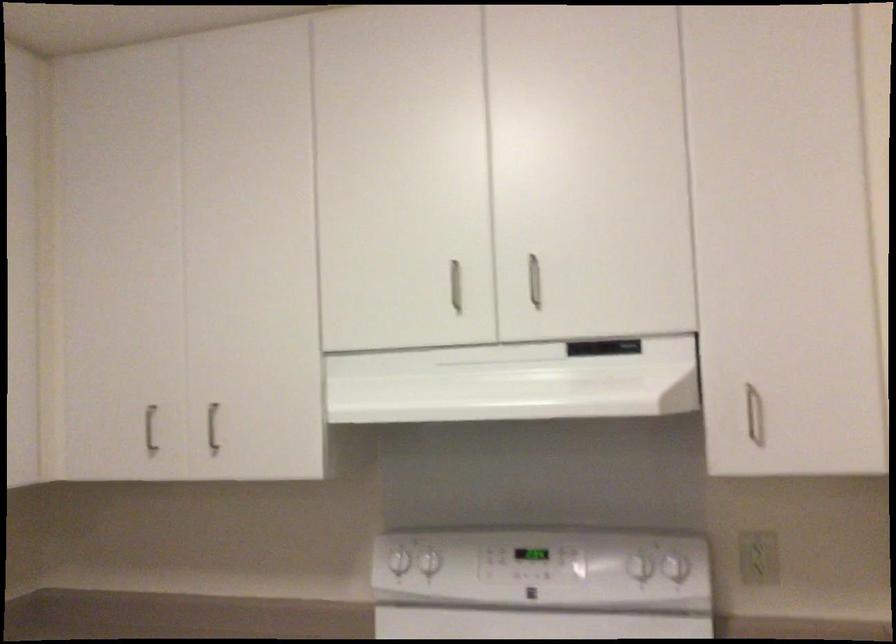
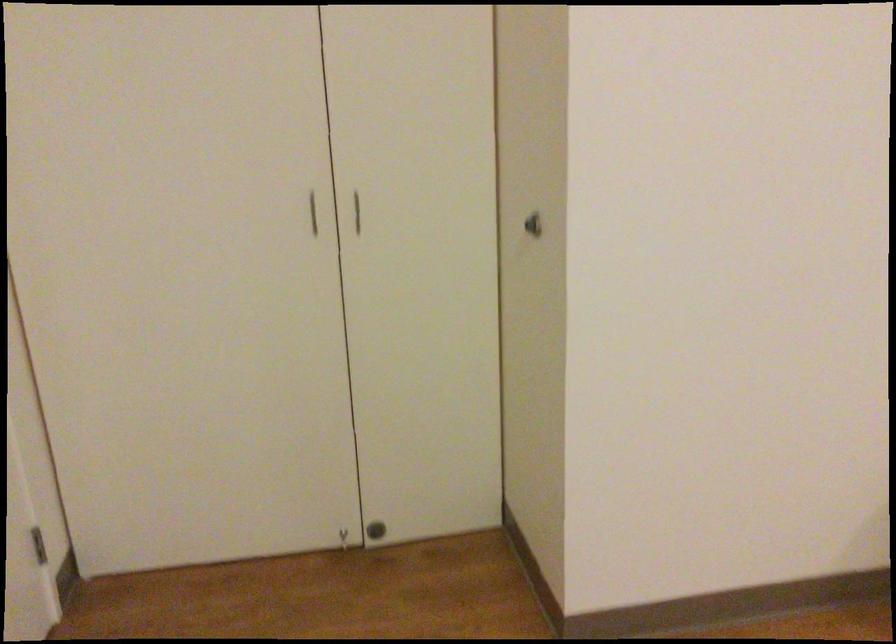
The images are taken continuously from a first-person perspective. In which direction is your viewpoint rotating?

The camera rotated toward right-down.